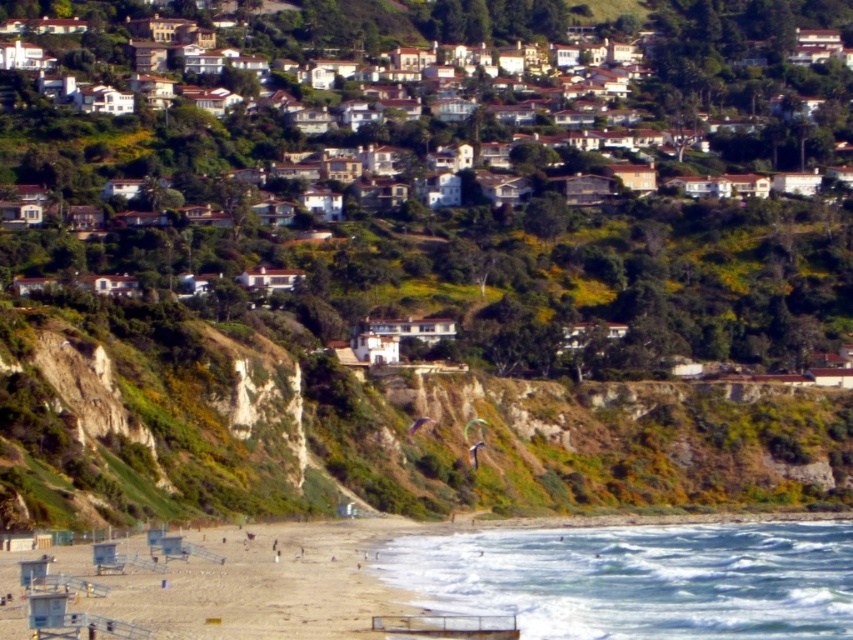
Question: Among these objects, which one is nearest to the camera?

Choices:
 (A) blue-green water at lower center
 (B) white stucco houses at center
 (C) beige sandy beach at lower left

Answer: (C)

Question: Can you confirm if white stucco houses at center is thinner than blue-green water at lower center?

Choices:
 (A) no
 (B) yes

Answer: (A)

Question: Does white stucco houses at center come behind beige sandy beach at lower left?

Choices:
 (A) no
 (B) yes

Answer: (B)

Question: From the image, what is the correct spatial relationship of blue-green water at lower center in relation to beige sandy beach at lower left?

Choices:
 (A) below
 (B) above

Answer: (A)

Question: Which object is closer to the camera taking this photo?

Choices:
 (A) white stucco houses at center
 (B) beige sandy beach at lower left

Answer: (B)

Question: Among these points, which one is nearest to the camera?

Choices:
 (A) (570, 572)
 (B) (543, 275)
 (C) (183, 577)

Answer: (C)